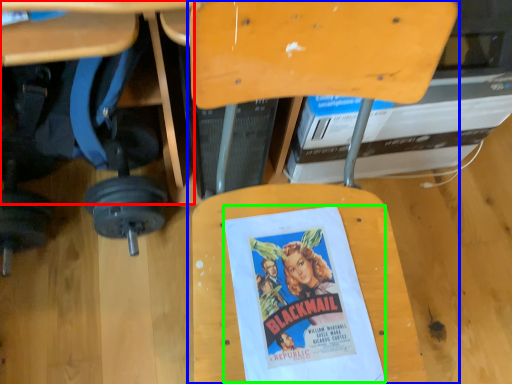
Question: Which object is positioned closest to table (highlighted by a red box)? Select from chair (highlighted by a blue box) and movie poster (highlighted by a green box).

Choices:
 (A) chair
 (B) movie poster

Answer: (A)